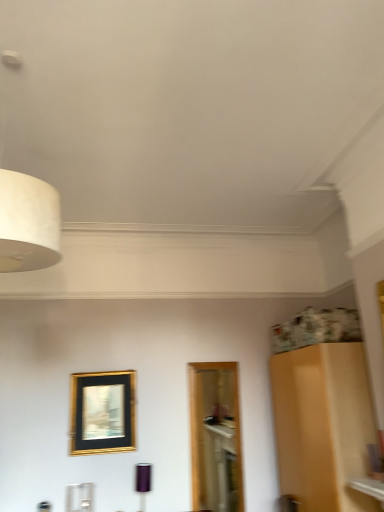
Question: Does gold/black/glass picture frame at center come in front of white matte lampshade at upper left, the 2th lamp positioned from the right?

Choices:
 (A) no
 (B) yes

Answer: (A)

Question: Does gold/black/glass picture frame at center turn towards white matte lampshade at upper left, which is the 1th lamp in top-to-bottom order?

Choices:
 (A) yes
 (B) no

Answer: (A)

Question: Does gold/black/glass picture frame at center have a smaller size compared to white matte lampshade at upper left, positioned as the 2th lamp in bottom-to-top order?

Choices:
 (A) no
 (B) yes

Answer: (B)

Question: Considering the relative sizes of gold/black/glass picture frame at center and white matte lampshade at upper left, which is the 1th lamp in top-to-bottom order, in the image provided, is gold/black/glass picture frame at center taller than white matte lampshade at upper left, which is the 1th lamp in top-to-bottom order,?

Choices:
 (A) no
 (B) yes

Answer: (A)

Question: Does gold/black/glass picture frame at center have a larger size compared to white matte lampshade at upper left, placed as the 1th lamp when sorted from front to back?

Choices:
 (A) no
 (B) yes

Answer: (A)

Question: Is white matte lampshade at upper left, the 2th lamp positioned from the right, at the back of gold/black/glass picture frame at center?

Choices:
 (A) no
 (B) yes

Answer: (A)

Question: Can you confirm if white matte lampshade at upper left, which is the 1th lamp in top-to-bottom order, is taller than matte black lampshade at lower center, which ranks as the 2th lamp in top-to-bottom order?

Choices:
 (A) no
 (B) yes

Answer: (B)

Question: Considering the relative sizes of white matte lampshade at upper left, the second lamp when ordered from back to front, and matte black lampshade at lower center, which is counted as the second lamp, starting from the front, in the image provided, is white matte lampshade at upper left, the second lamp when ordered from back to front, wider than matte black lampshade at lower center, which is counted as the second lamp, starting from the front,?

Choices:
 (A) yes
 (B) no

Answer: (A)

Question: From a real-world perspective, is white matte lampshade at upper left, the second lamp when ordered from back to front, below matte black lampshade at lower center, positioned as the first lamp in bottom-to-top order?

Choices:
 (A) yes
 (B) no

Answer: (B)

Question: Is white matte lampshade at upper left, which appears as the first lamp when viewed from the left, smaller than matte black lampshade at lower center, which is counted as the second lamp, starting from the front?

Choices:
 (A) yes
 (B) no

Answer: (B)

Question: Is white matte lampshade at upper left, which is the 1th lamp in top-to-bottom order, turned away from matte black lampshade at lower center, which is counted as the 2th lamp, starting from the left?

Choices:
 (A) yes
 (B) no

Answer: (B)

Question: Does white matte lampshade at upper left, which is the 1th lamp in top-to-bottom order, lie behind matte black lampshade at lower center, placed as the first lamp when sorted from right to left?

Choices:
 (A) yes
 (B) no

Answer: (B)

Question: Considering the relative positions of matte black lampshade at lower center, which appears as the first lamp when viewed from the back, and white matte lampshade at upper left, positioned as the 2th lamp in bottom-to-top order, in the image provided, is matte black lampshade at lower center, which appears as the first lamp when viewed from the back, behind white matte lampshade at upper left, positioned as the 2th lamp in bottom-to-top order,?

Choices:
 (A) no
 (B) yes

Answer: (B)